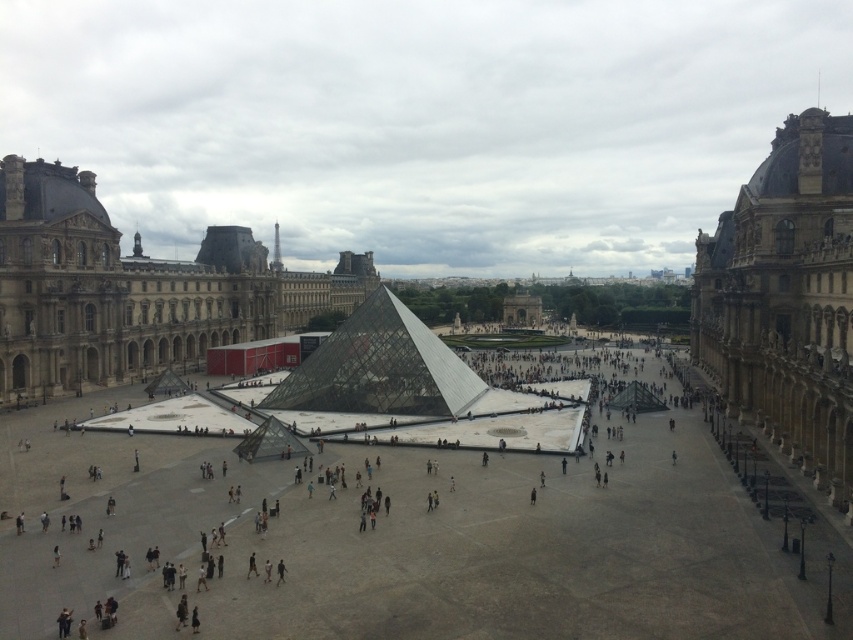
The image size is (853, 640). What do you see at coordinates (786, 300) in the screenshot?
I see `golden stone palace at right` at bounding box center [786, 300].

From the picture: Who is taller, golden stone palace at right or transparent glass pyramid at center?

golden stone palace at right is taller.

Identify the location of golden stone palace at right. The width and height of the screenshot is (853, 640). (786, 300).

Does brown stone building at left appear on the right side of transparent glass pyramid at center?

In fact, brown stone building at left is to the left of transparent glass pyramid at center.

The image size is (853, 640). What do you see at coordinates (134, 289) in the screenshot?
I see `brown stone building at left` at bounding box center [134, 289].

Find the location of a particular element. This screenshot has width=853, height=640. brown stone building at left is located at coordinates (134, 289).

Which of these two, brown stone building at left or golden stone palace at right, stands taller?

With more height is brown stone building at left.

Is brown stone building at left above golden stone palace at right?

Yes, brown stone building at left is above golden stone palace at right.

Between point (45, 257) and point (782, 140), which one is positioned behind?

The point (45, 257) is behind.

Where is `brown stone building at left`? brown stone building at left is located at coordinates (134, 289).